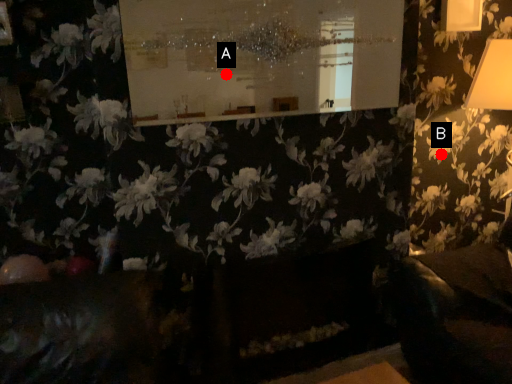
Question: Two points are circled on the image, labeled by A and B beside each circle. Among these points, which one is farthest from the camera?

Choices:
 (A) A is further
 (B) B is further

Answer: (B)